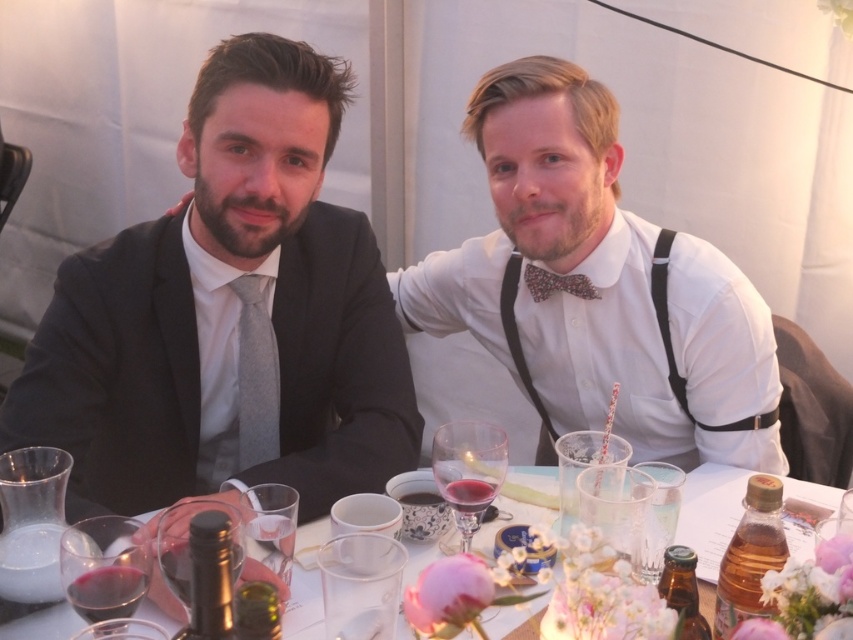
You are a photographer at a wedding reception. You need to capture a closeup shot of the transparent glass wine glass at center without including the matte black suit at left in the frame. Is this possible given their sizes?

The matte black suit at left has a larger size compared to transparent glass wine glass at center. Therefore, it may be challenging to frame the transparent glass wine glass at center without including the matte black suit at left due to its larger size taking up more space in the composition.

You are a server at the event and need to place a 7.5 inch wide decorative plate between the translucent glass vase at center and the transparent glass wine glass at center. Can you fit it without moving either object?

The distance between the translucent glass vase at center and the transparent glass wine glass at center is 7.53 inches. Since the plate is 7.5 inches wide, it should fit with a small amount of space remaining.

You are a server at a formal event and need to place a centerpiece on the table between the two individuals. The translucent glass vase at center and the transparent glass wine glass at center are already there. Which object should you use to hold flowers, and why?

You should use the translucent glass vase at center because it is bigger than the transparent glass wine glass at center, making it more suitable for holding flowers as a centerpiece.